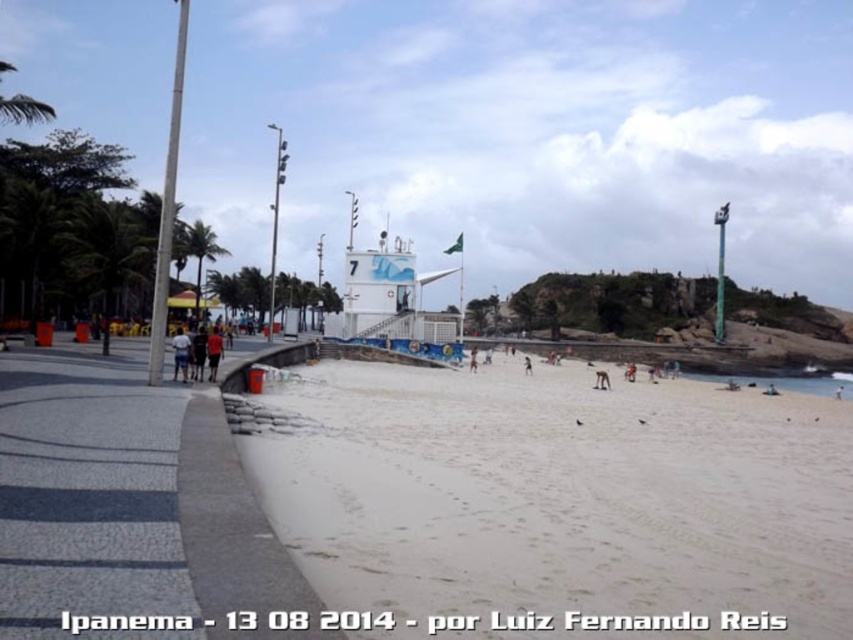
You are a tourist visiting Ipanema Beach and notice the brown leather sandal at lower center and the light brown sand at center. Which object is closer to you based on their positions?

The brown leather sandal at lower center is closer to you because it is positioned in front of the light brown sand at center.

You are standing at the point with coordinates point (80, 269) and want to walk towards the point with coordinates point (456, 593). Which direction should you face to walk directly towards your destination?

You should face towards the direction of point (456, 593) because it is in front of point (80, 269).